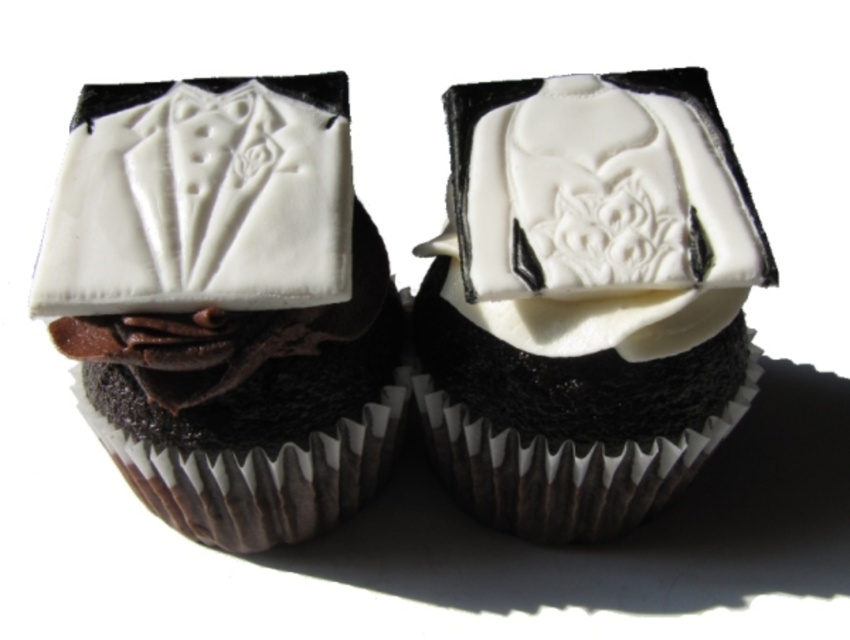
You are a baker who wants to ensure that the white glossy fondant at center and the white fondant tuxedo at center on the cupcakes are displayed properly. Which of the two has a taller structure?

The white glossy fondant at center has a greater height compared to the white fondant tuxedo at center, so it is taller.

From the picture: You are a baker who wants to ensure that the decorations on both cupcakes are proportionate. Given that the white glossy fondant groom at center and the white fondant tuxedo at center are both on the same cupcake, which decoration should you adjust to make them match in size?

The white glossy fondant groom at center is bigger than the white fondant tuxedo at center, so you should reduce the size of the white glossy fondant groom at center to match the smaller white fondant tuxedo at center.